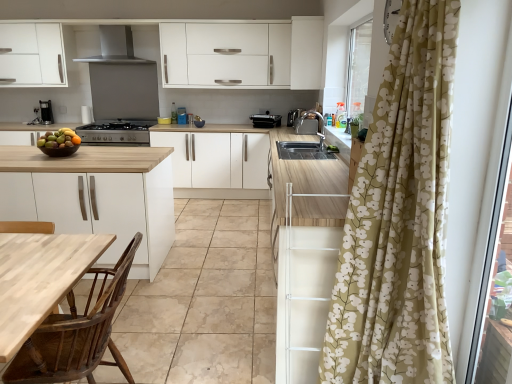
Question: Can you confirm if wooden polished chair at lower left is smaller than shiny brown bowl at left?

Choices:
 (A) no
 (B) yes

Answer: (A)

Question: Considering the relative positions of wooden polished chair at lower left and shiny brown bowl at left in the image provided, is wooden polished chair at lower left to the left of shiny brown bowl at left from the viewer's perspective?

Choices:
 (A) no
 (B) yes

Answer: (A)

Question: From the image's perspective, is wooden polished chair at lower left above shiny brown bowl at left?

Choices:
 (A) yes
 (B) no

Answer: (B)

Question: Does wooden polished chair at lower left have a lesser width compared to shiny brown bowl at left?

Choices:
 (A) yes
 (B) no

Answer: (B)

Question: Is wooden polished chair at lower left not inside shiny brown bowl at left?

Choices:
 (A) no
 (B) yes

Answer: (B)

Question: Choose the correct answer: Is white matte cabinet at center, the 1th cabinetry from the bottom, inside satin silver toaster at upper center, the 1th appliance positioned from the right, or outside it?

Choices:
 (A) outside
 (B) inside

Answer: (A)

Question: From their relative heights in the image, would you say white matte cabinet at center, the 1th cabinetry viewed from the left, is taller or shorter than satin silver toaster at upper center, the 1th appliance positioned from the right?

Choices:
 (A) short
 (B) tall

Answer: (B)

Question: Considering the positions of white matte cabinet at center, which appears as the 2th cabinetry when viewed from the right, and satin silver toaster at upper center, the 1th appliance positioned from the right, in the image, is white matte cabinet at center, which appears as the 2th cabinetry when viewed from the right, wider or thinner than satin silver toaster at upper center, the 1th appliance positioned from the right,?

Choices:
 (A) thin
 (B) wide

Answer: (B)

Question: From a real-world perspective, relative to satin silver toaster at upper center, which is the second appliance from left to right, is white matte cabinet at center, which appears as the 2th cabinetry when viewed from the right, vertically above or below?

Choices:
 (A) below
 (B) above

Answer: (A)

Question: From the image's perspective, is wooden at left above or below white matte cabinet at center, the second cabinetry positioned from the top?

Choices:
 (A) above
 (B) below

Answer: (B)

Question: Considering their positions, is wooden at left located in front of or behind white matte cabinet at center, the 1th cabinetry viewed from the left?

Choices:
 (A) behind
 (B) front

Answer: (B)

Question: Looking at the image, does wooden at left seem bigger or smaller compared to white matte cabinet at center, the second cabinetry positioned from the top?

Choices:
 (A) small
 (B) big

Answer: (B)

Question: Looking at their shapes, would you say wooden at left is wider or thinner than white matte cabinet at center, the 1th cabinetry from the bottom?

Choices:
 (A) thin
 (B) wide

Answer: (B)

Question: Considering their positions, is satin black stove at center located in front of or behind black plastic toaster at center, which is counted as the second appliance, starting from the right?

Choices:
 (A) front
 (B) behind

Answer: (A)

Question: In the image, is satin black stove at center on the left side or the right side of black plastic toaster at center, which appears as the 1th appliance when viewed from the left?

Choices:
 (A) left
 (B) right

Answer: (A)